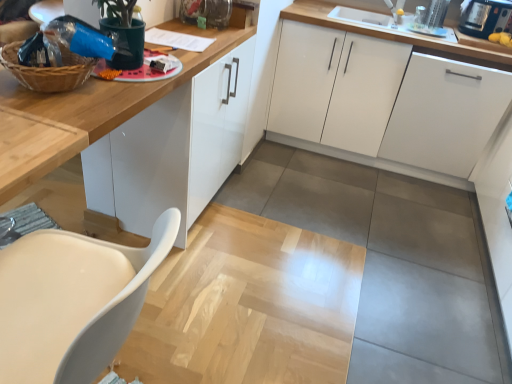
Identify the location of free point above woven brown basket at upper left (from a real-world perspective). (52, 46).